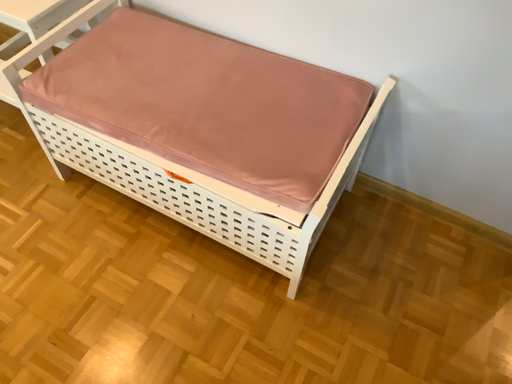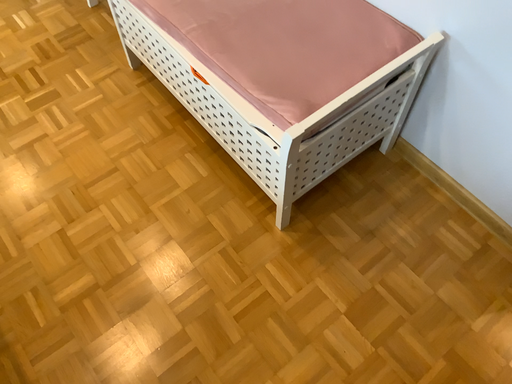
Question: How did the camera likely rotate when shooting the video?

Choices:
 (A) rotated left
 (B) rotated right

Answer: (A)